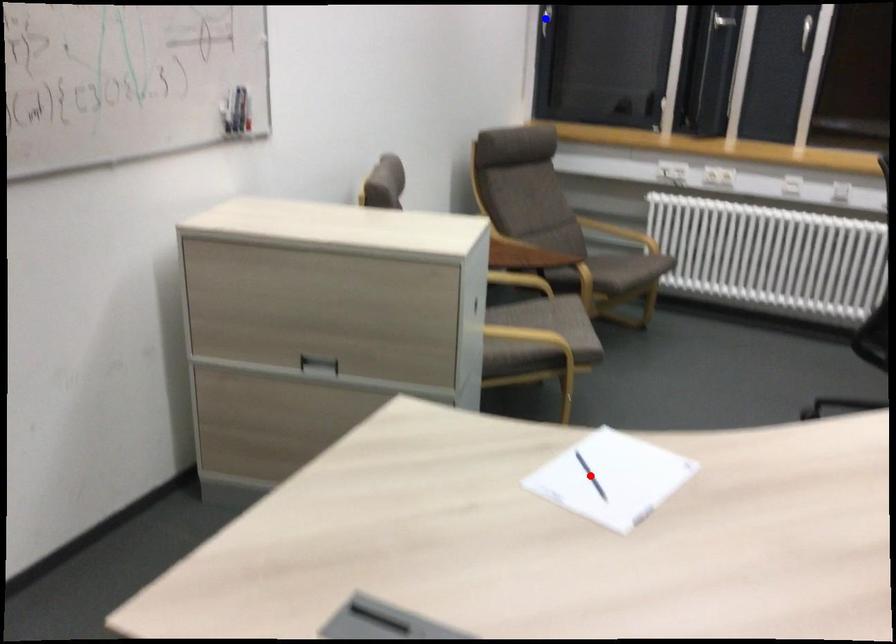
Question: In the image, two points are highlighted. Which point is nearer to the camera? Reply with the corresponding letter.

Choices:
 (A) blue point
 (B) red point

Answer: (B)